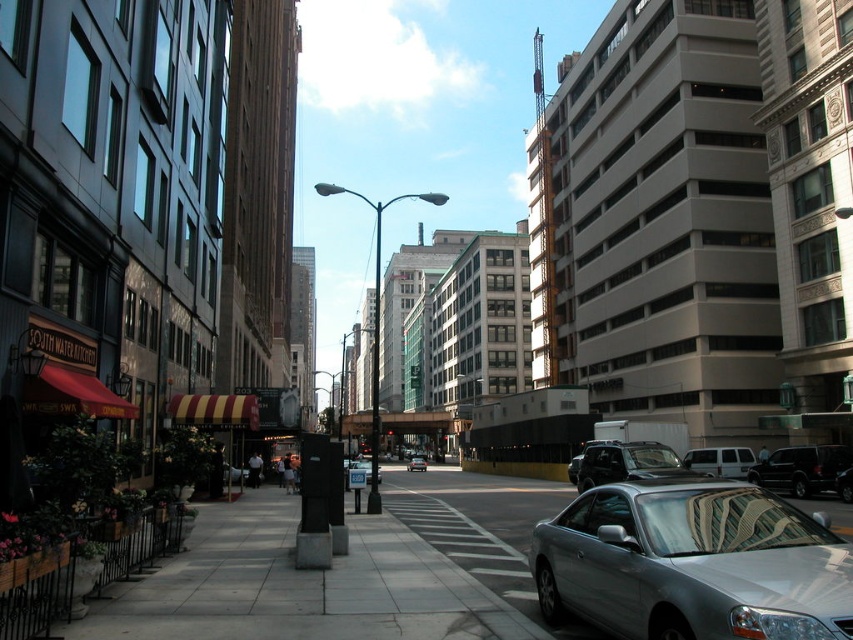
You are a pedestrian standing on the sidewalk and want to cross the street to reach the shops on the left. There is a white matte van at center and a silver metallic car at center blocking your path. Which vehicle should you move around first to get to the shops?

The white matte van at center is positioned on the right side of the silver metallic car at center, so you should move around the silver metallic car at center first before the white matte van at center to reach the shops on the left.

You are standing at the point with coordinates 0.8, 0.3 in the image. You want to walk to the gray concrete sidewalk at center. In which direction should you move?

The gray concrete sidewalk at center is located at point (x=302, y=586). Since your current position is at (x=254, y=512), you should move northeast to reach it.

You are standing on the sidewalk in the urban street scene and want to walk from the point at coordinates point (813,456) to the point at coordinates point (376,476). Which direction should you move to get closer to your destination?

You should move forward because point (813,456) is further to the viewer than point (376,476), so moving forward will bring you closer to the destination point (376,476).